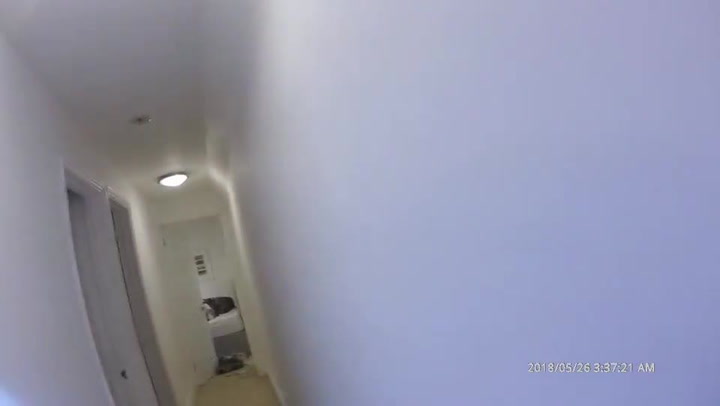
Locate an element on the screen. white mattress is located at coordinates (230, 317).